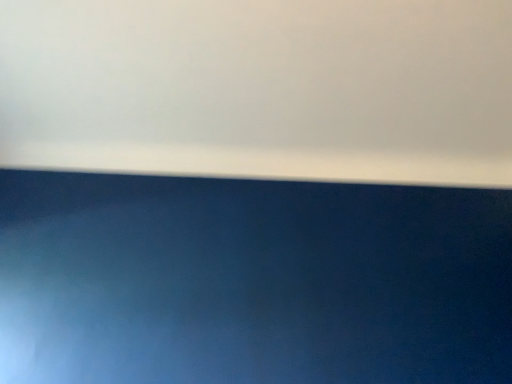
This screenshot has width=512, height=384. What do you see at coordinates (261, 88) in the screenshot? I see `white matte board at upper center` at bounding box center [261, 88].

Locate an element on the screen. white matte board at upper center is located at coordinates (261, 88).

What is the approximate width of white matte board at upper center?

It is 3.32 meters.

I want to click on white matte board at upper center, so click(x=261, y=88).